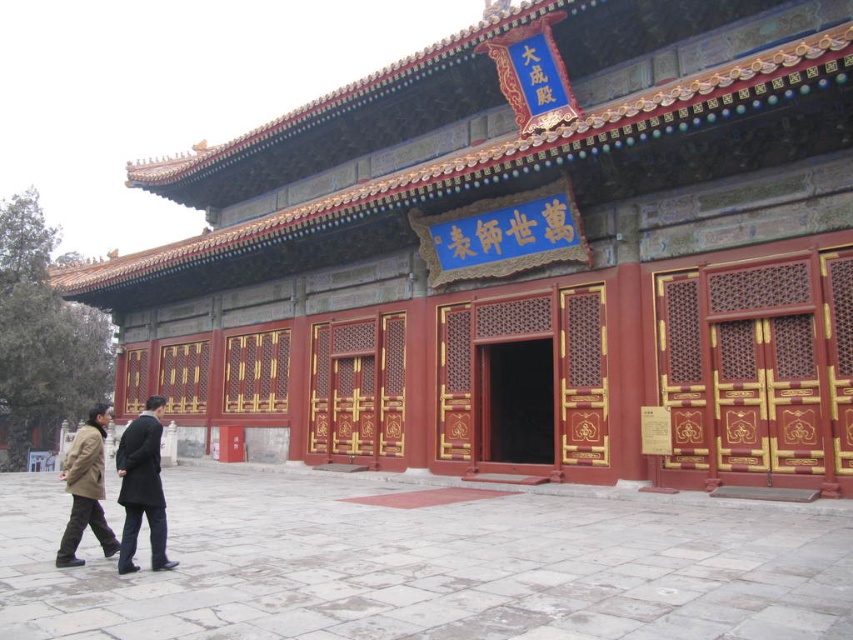
Question: Which of the following is the farthest from the observer?

Choices:
 (A) (834, 132)
 (B) (142, 419)

Answer: (A)

Question: Which point is closer to the camera?

Choices:
 (A) (630, 184)
 (B) (131, 467)

Answer: (B)

Question: Does matte red wood palace at center lie behind dark gray wool coat at lower left?

Choices:
 (A) no
 (B) yes

Answer: (B)

Question: From the image, what is the correct spatial relationship of matte red wood palace at center in relation to dark gray wool coat at lower left?

Choices:
 (A) above
 (B) below

Answer: (A)

Question: Estimate the real-world distances between objects in this image. Which object is closer to the dark gray wool coat at lower left?

Choices:
 (A) brown leather jacket at lower left
 (B) matte red wood palace at center

Answer: (A)

Question: Where is dark gray wool coat at lower left located in relation to brown leather jacket at lower left in the image?

Choices:
 (A) right
 (B) left

Answer: (A)